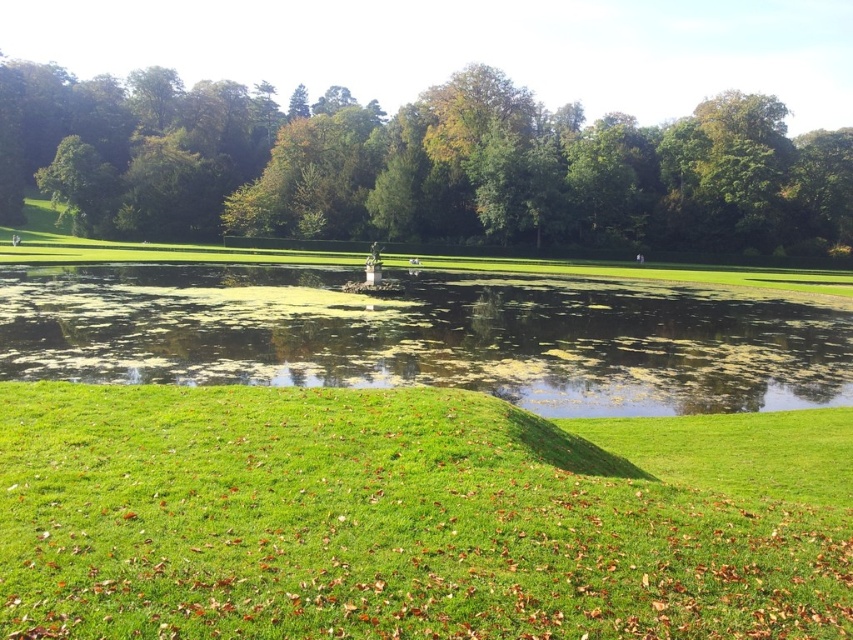
You are standing in the park and want to walk to the point closer to you between point (62, 397) and point (85, 330). Which point should you head towards?

Point (62, 397) is closer to the viewer than point (85, 330), so you should head towards point (62, 397).